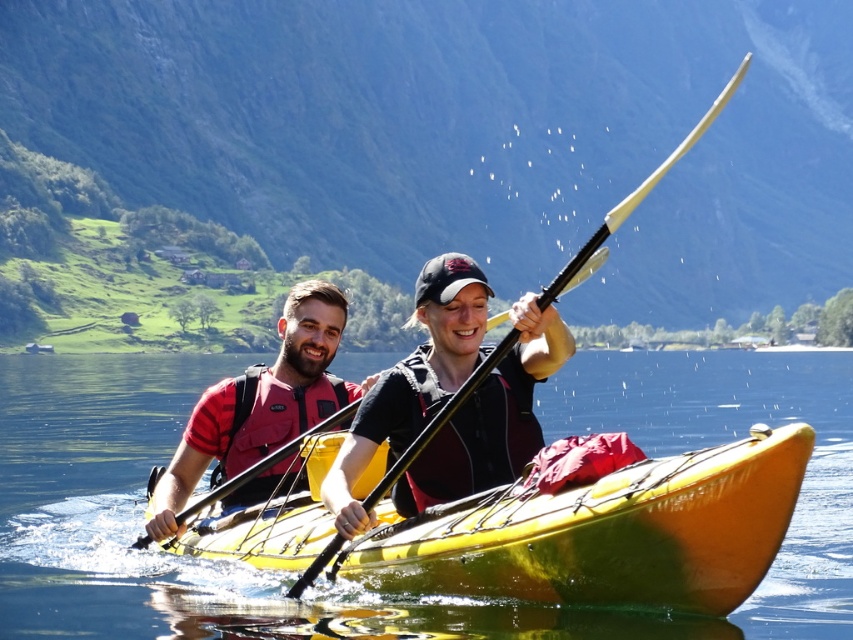
Is matte black kayak paddle at center shorter than red matte life vest at left?

Yes.

Who is more forward, (485, 456) or (306, 323)?

Positioned in front is point (485, 456).

Consider the image. Measure the distance between matte black kayak paddle at center and camera.

The distance of matte black kayak paddle at center from camera is 39.20 meters.

Locate an element on the screen. The image size is (853, 640). matte black kayak paddle at center is located at coordinates (415, 378).

Does matte black kayak paddle at center have a larger size compared to black matte paddle at center?

No.

The width and height of the screenshot is (853, 640). Identify the location of matte black kayak paddle at center. [x=415, y=378].

Is point (416, 388) closer to camera compared to point (596, 230)?

No.

Find the location of a particular element. The height and width of the screenshot is (640, 853). matte black kayak paddle at center is located at coordinates (415, 378).

Is yellow glossy canoe at center positioned behind red matte life vest at left?

That is False.

Who is shorter, yellow glossy canoe at center or red matte life vest at left?

Standing shorter between the two is yellow glossy canoe at center.

Locate an element on the screen. Image resolution: width=853 pixels, height=640 pixels. yellow glossy canoe at center is located at coordinates (602, 532).